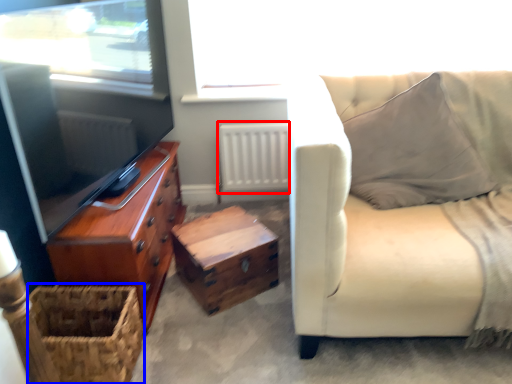
Question: Which of the following is the closest to the observer, radiator (highlighted by a red box) or basket (highlighted by a blue box)?

Choices:
 (A) radiator
 (B) basket

Answer: (B)